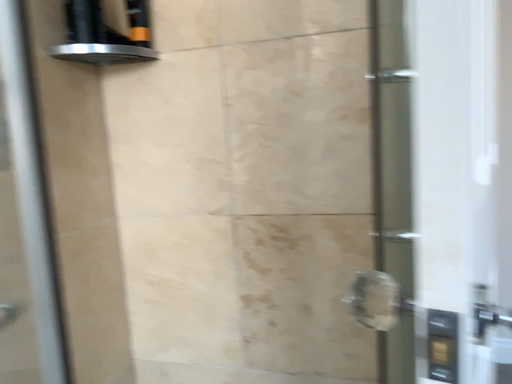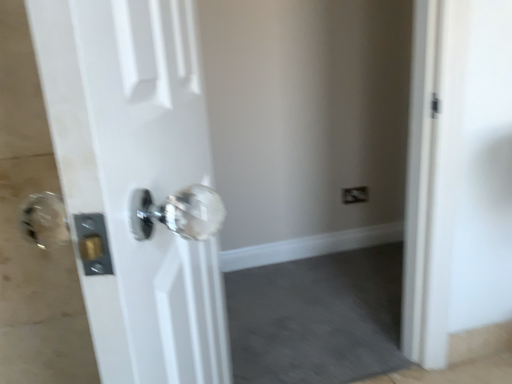
Question: How did the camera likely rotate when shooting the video?

Choices:
 (A) rotated upward
 (B) rotated downward

Answer: (B)